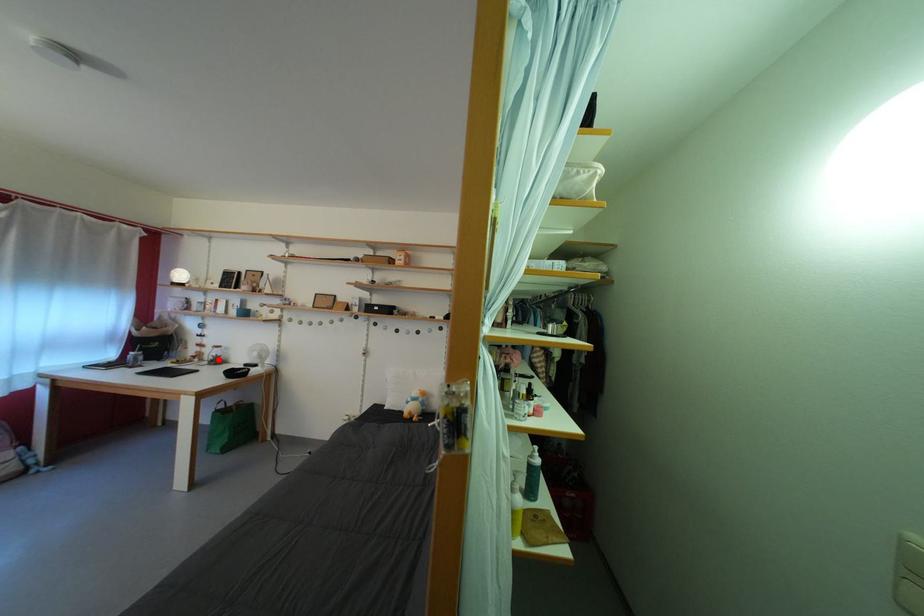
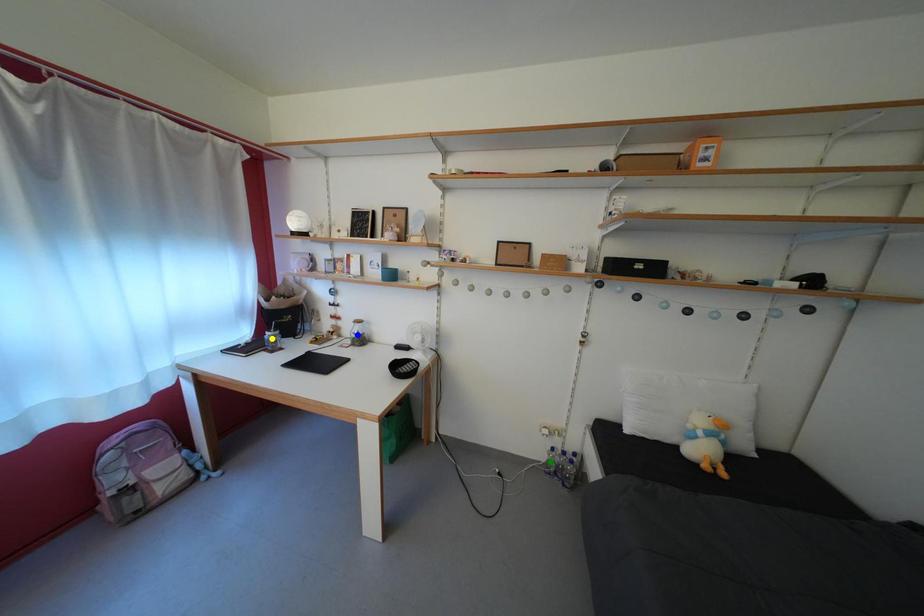
Question: I am providing you with two images of the same scene from different viewpoints. A red point is marked on the first image. You are given multiple points on the second image. In image 2, which mark is for the same physical point as the one in image 1?

Choices:
 (A) green point
 (B) blue point
 (C) yellow point

Answer: (B)